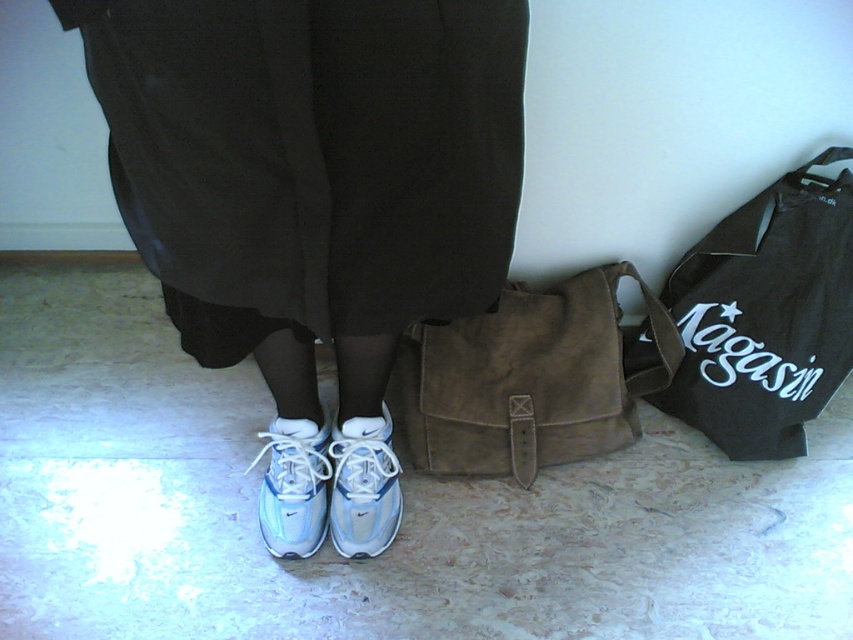
Between black canvas tote bag at right and white suede shoe at center, which one is positioned higher?

black canvas tote bag at right is above.

Who is more forward, (x=740, y=332) or (x=361, y=420)?

Point (x=361, y=420)

This screenshot has width=853, height=640. What are the coordinates of `black canvas tote bag at right` in the screenshot? It's located at (764, 316).

Who is positioned more to the right, black canvas tote bag at right or white mesh shoe at lower center?

black canvas tote bag at right

Looking at this image, between black canvas tote bag at right and white mesh shoe at lower center, which one has less height?

Standing shorter between the two is white mesh shoe at lower center.

Identify the location of black canvas tote bag at right. (764, 316).

At what (x,y) coordinates should I click in order to perform the action: click on suede brown bag at center. Please return your answer as a coordinate pair (x, y). Image resolution: width=853 pixels, height=640 pixels. Looking at the image, I should click on (531, 380).

Between point (523, 312) and point (265, 474), which one is positioned in front?

Point (265, 474)

Is point (546, 406) more distant than point (293, 529)?

Yes, point (546, 406) is farther from viewer.

This screenshot has width=853, height=640. What are the coordinates of `suede brown bag at center` in the screenshot? It's located at (531, 380).